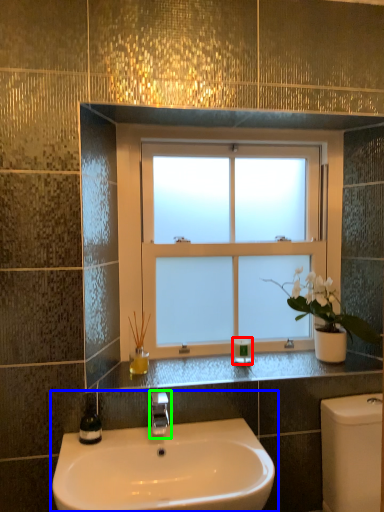
Question: Considering the real-world distances, which object is farthest from toiletry (highlighted by a red box)? sink (highlighted by a blue box) or tap (highlighted by a green box)?

Choices:
 (A) sink
 (B) tap

Answer: (A)